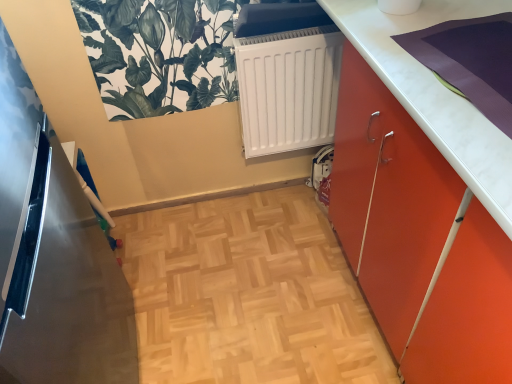
Identify the location of vacant area situated below white matte radiator at center (from a real-world perspective). (276, 194).